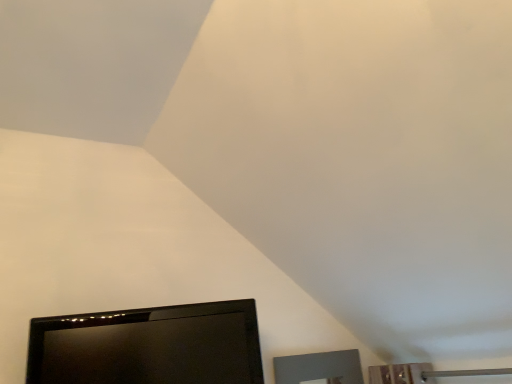
Where is `black glossy tv at lower left`? This screenshot has width=512, height=384. black glossy tv at lower left is located at coordinates [x=149, y=346].

Describe the element at coordinates (149, 346) in the screenshot. I see `black glossy tv at lower left` at that location.

Locate an element on the screen. Image resolution: width=512 pixels, height=384 pixels. black glossy tv at lower left is located at coordinates click(x=149, y=346).